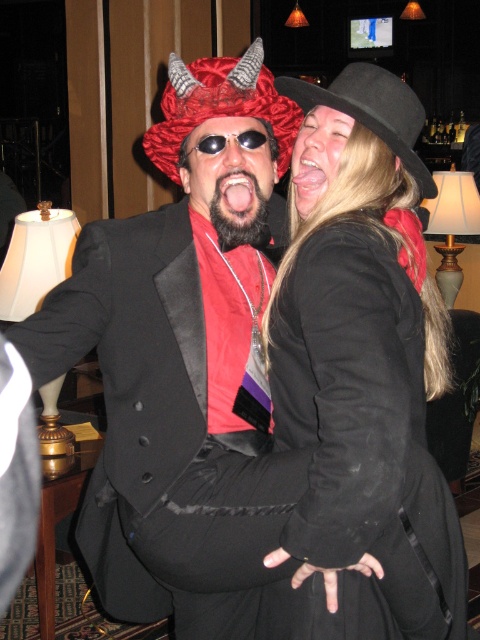
Between black matte coat at center and shiny red fabric hat at upper center, which one has less height?

shiny red fabric hat at upper center is shorter.

Between point (415, 636) and point (233, 97), which one is positioned in front?

Point (415, 636) is in front.

Where is `black matte coat at center`? black matte coat at center is located at coordinates (362, 369).

Which is more to the right, black matte coat at center or sunglassesmetallicgoggles at center?

black matte coat at center

Is black matte coat at center wider than sunglassesmetallicgoggles at center?

Yes.

Does point (384, 408) come in front of point (203, 138)?

Yes.

This screenshot has width=480, height=640. I want to click on black matte coat at center, so click(362, 369).

Does shiny red fabric hat at upper center have a smaller size compared to black felt hat at upper right?

Incorrect, shiny red fabric hat at upper center is not smaller in size than black felt hat at upper right.

Does shiny red fabric hat at upper center have a greater width compared to black felt hat at upper right?

Incorrect, shiny red fabric hat at upper center's width does not surpass black felt hat at upper right's.

Describe the element at coordinates (219, 104) in the screenshot. The image size is (480, 640). I see `shiny red fabric hat at upper center` at that location.

Where is `shiny red fabric hat at upper center`? shiny red fabric hat at upper center is located at coordinates (219, 104).